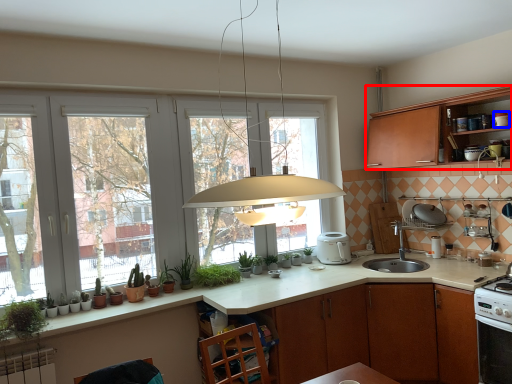
Question: Which of the following is the closest to the observer, cabinetry (highlighted by a red box) or appliance (highlighted by a blue box)?

Choices:
 (A) cabinetry
 (B) appliance

Answer: (A)